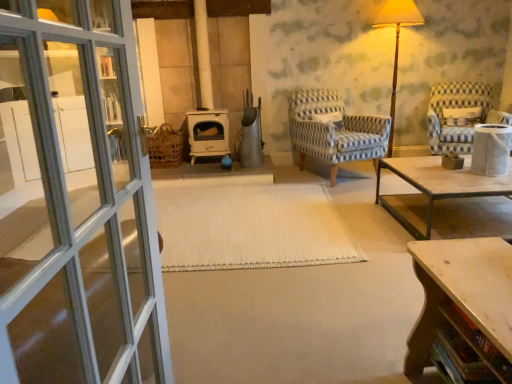
Question: From the image's perspective, is blue-patterned fabric chair at center, placed as the second chair when sorted from right to left, above wooden table at lower right?

Choices:
 (A) yes
 (B) no

Answer: (A)

Question: Is blue-patterned fabric chair at center, placed as the second chair when sorted from right to left, beside wooden table at lower right?

Choices:
 (A) yes
 (B) no

Answer: (B)

Question: Can you confirm if blue-patterned fabric chair at center, placed as the second chair when sorted from right to left, is wider than wooden table at lower right?

Choices:
 (A) yes
 (B) no

Answer: (A)

Question: Is blue-patterned fabric chair at center, placed as the second chair when sorted from right to left, shorter than wooden table at lower right?

Choices:
 (A) yes
 (B) no

Answer: (B)

Question: Is blue-patterned fabric chair at center, placed as the second chair when sorted from right to left, at the left side of wooden table at lower right?

Choices:
 (A) yes
 (B) no

Answer: (B)

Question: Is wooden table at lower right completely or partially inside blue-patterned fabric chair at center, placed as the second chair when sorted from right to left?

Choices:
 (A) yes
 (B) no

Answer: (B)

Question: Is the position of blue and white patterned fabric armchair at right, which is counted as the first chair, starting from the right, more distant than that of wooden floor lamp at upper right?

Choices:
 (A) yes
 (B) no

Answer: (B)

Question: Can you confirm if blue and white patterned fabric armchair at right, which is counted as the first chair, starting from the right, is shorter than wooden floor lamp at upper right?

Choices:
 (A) no
 (B) yes

Answer: (B)

Question: Is blue and white patterned fabric armchair at right, which is the second chair in left-to-right order, positioned with its back to wooden floor lamp at upper right?

Choices:
 (A) no
 (B) yes

Answer: (A)

Question: Does blue and white patterned fabric armchair at right, which is counted as the first chair, starting from the right, have a smaller size compared to wooden floor lamp at upper right?

Choices:
 (A) yes
 (B) no

Answer: (B)

Question: Is blue and white patterned fabric armchair at right, which is the second chair in left-to-right order, wider than wooden floor lamp at upper right?

Choices:
 (A) no
 (B) yes

Answer: (B)

Question: From a real-world perspective, is blue and white patterned fabric armchair at right, which is the second chair in left-to-right order, physically above wooden floor lamp at upper right?

Choices:
 (A) yes
 (B) no

Answer: (B)

Question: Is wooden side table at right smaller than blue-patterned fabric chair at center, the 1th chair when ordered from left to right?

Choices:
 (A) yes
 (B) no

Answer: (A)